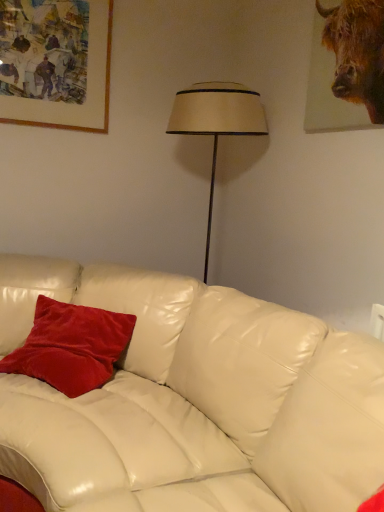
Question: Is wooden picture frame at upper left placed right next to brown textured fur at upper right?

Choices:
 (A) yes
 (B) no

Answer: (B)

Question: Considering the relative sizes of wooden picture frame at upper left and brown textured fur at upper right in the image provided, is wooden picture frame at upper left bigger than brown textured fur at upper right?

Choices:
 (A) yes
 (B) no

Answer: (A)

Question: Considering the relative positions of wooden picture frame at upper left and brown textured fur at upper right in the image provided, is wooden picture frame at upper left to the left of brown textured fur at upper right from the viewer's perspective?

Choices:
 (A) yes
 (B) no

Answer: (A)

Question: Considering the relative sizes of wooden picture frame at upper left and brown textured fur at upper right in the image provided, is wooden picture frame at upper left thinner than brown textured fur at upper right?

Choices:
 (A) no
 (B) yes

Answer: (A)

Question: Is wooden picture frame at upper left positioned before brown textured fur at upper right?

Choices:
 (A) no
 (B) yes

Answer: (A)

Question: Is wooden picture frame at upper left aimed at brown textured fur at upper right?

Choices:
 (A) no
 (B) yes

Answer: (A)

Question: Is wooden picture frame at upper left looking in the opposite direction of velvet red pillow at center?

Choices:
 (A) yes
 (B) no

Answer: (B)

Question: Does wooden picture frame at upper left lie behind velvet red pillow at center?

Choices:
 (A) no
 (B) yes

Answer: (B)

Question: Is wooden picture frame at upper left bigger than velvet red pillow at center?

Choices:
 (A) no
 (B) yes

Answer: (A)

Question: Is wooden picture frame at upper left not near velvet red pillow at center?

Choices:
 (A) no
 (B) yes

Answer: (B)

Question: Is wooden picture frame at upper left closer to the viewer compared to velvet red pillow at center?

Choices:
 (A) no
 (B) yes

Answer: (A)

Question: Is wooden picture frame at upper left beside velvet red pillow at center?

Choices:
 (A) yes
 (B) no

Answer: (B)

Question: From the image's perspective, would you say brown textured fur at upper right is positioned over velvet red pillow at center?

Choices:
 (A) yes
 (B) no

Answer: (A)